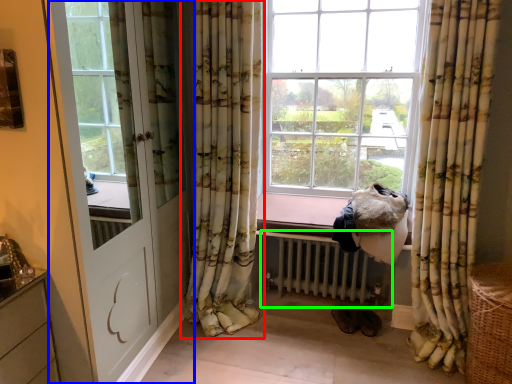
Question: Estimate the real-world distances between objects in this image. Which object is closer to curtain (highlighted by a red box), door (highlighted by a blue box) or radiator (highlighted by a green box)?

Choices:
 (A) door
 (B) radiator

Answer: (A)